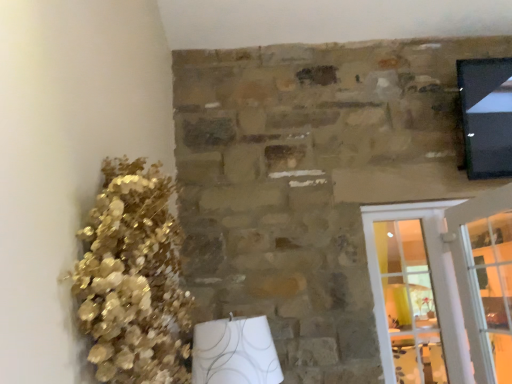
Question: From the image's perspective, is clear glass door at lower right on white glass screen door at right?

Choices:
 (A) yes
 (B) no

Answer: (A)

Question: Does clear glass door at lower right have a greater height compared to white glass screen door at right?

Choices:
 (A) no
 (B) yes

Answer: (A)

Question: Is clear glass door at lower right shorter than white glass screen door at right?

Choices:
 (A) yes
 (B) no

Answer: (A)

Question: From the image's perspective, is clear glass door at lower right under white glass screen door at right?

Choices:
 (A) no
 (B) yes

Answer: (A)

Question: Can you confirm if clear glass door at lower right is positioned to the right of white glass screen door at right?

Choices:
 (A) yes
 (B) no

Answer: (A)

Question: Considering their positions, is clear glass door at lower right located in front of or behind white glass screen door at right?

Choices:
 (A) front
 (B) behind

Answer: (A)

Question: Looking at the image, does clear glass door at lower right seem bigger or smaller compared to white glass screen door at right?

Choices:
 (A) big
 (B) small

Answer: (A)

Question: Considering the positions of point (486, 253) and point (504, 284), is point (486, 253) closer or farther from the camera than point (504, 284)?

Choices:
 (A) closer
 (B) farther

Answer: (A)

Question: In terms of height, does clear glass door at lower right look taller or shorter compared to white glass screen door at right?

Choices:
 (A) short
 (B) tall

Answer: (A)

Question: Is point (434, 261) positioned closer to the camera than point (141, 268)?

Choices:
 (A) closer
 (B) farther

Answer: (B)

Question: From a real-world perspective, is white glass screen door at right above or below gold metallic floral arrangement at left?

Choices:
 (A) above
 (B) below

Answer: (B)

Question: Is white glass screen door at right taller or shorter than gold metallic floral arrangement at left?

Choices:
 (A) short
 (B) tall

Answer: (B)

Question: Looking at their shapes, would you say white glass screen door at right is wider or thinner than gold metallic floral arrangement at left?

Choices:
 (A) thin
 (B) wide

Answer: (A)

Question: From a real-world perspective, is gold metallic floral arrangement at left physically located above or below white glass screen door at right?

Choices:
 (A) below
 (B) above

Answer: (B)

Question: Is point (102, 243) positioned closer to the camera than point (372, 278)?

Choices:
 (A) farther
 (B) closer

Answer: (B)